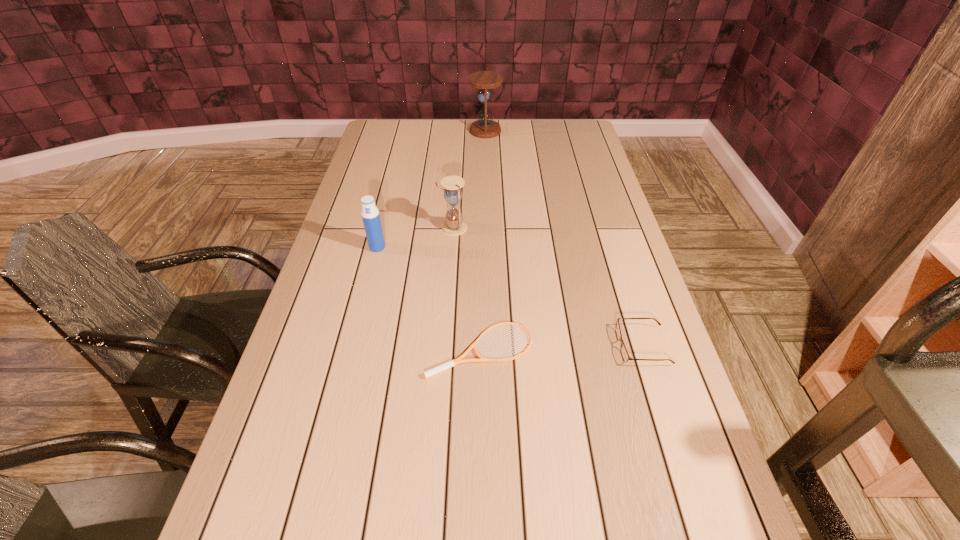
Locate an element on the screen. free space located 0.320m on the lenses of the spectacles is located at coordinates (483, 346).

This screenshot has height=540, width=960. Identify the location of vacant space located 0.190m on the lenses of the spectacles. (538, 346).

I want to click on blank area located on the lenses of the spectacles, so click(x=534, y=346).

Identify the location of vacant space located on the front of the tennis racket. (482, 400).

Where is `object present at the far edge`? This screenshot has width=960, height=540. object present at the far edge is located at coordinates (485, 127).

The width and height of the screenshot is (960, 540). I want to click on object present at the left edge, so click(370, 214).

Identify the location of object that is at the right edge. (625, 356).

This screenshot has height=540, width=960. In order to click on vacant space at the far edge in this screenshot , I will do `click(526, 130)`.

In the image, there is a desktop. Where is `free space at the left edge`? Image resolution: width=960 pixels, height=540 pixels. free space at the left edge is located at coordinates (370, 251).

Where is `free location at the right edge`? The height and width of the screenshot is (540, 960). free location at the right edge is located at coordinates (596, 323).